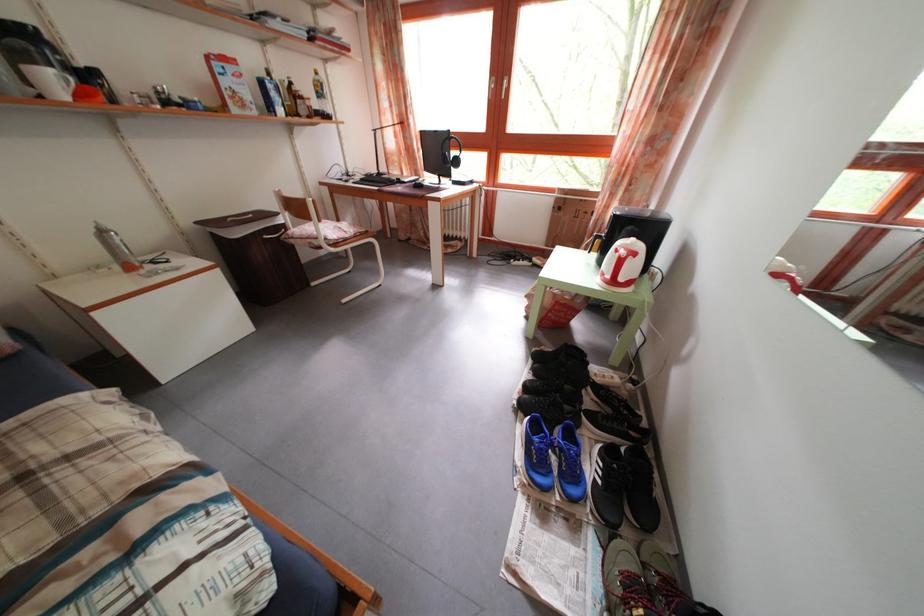
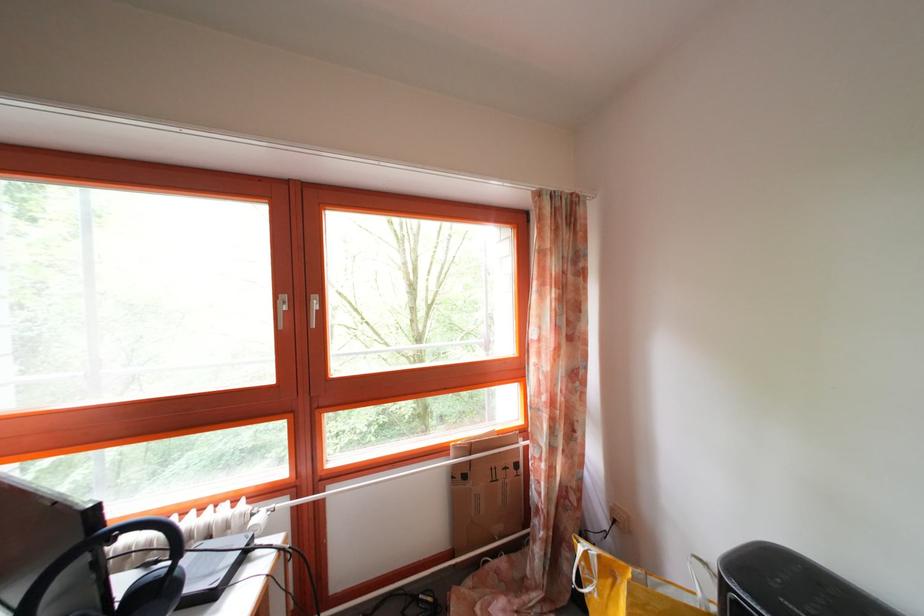
In the second image, find the point that corresponds to pixel 566 216 in the first image.

(472, 484)